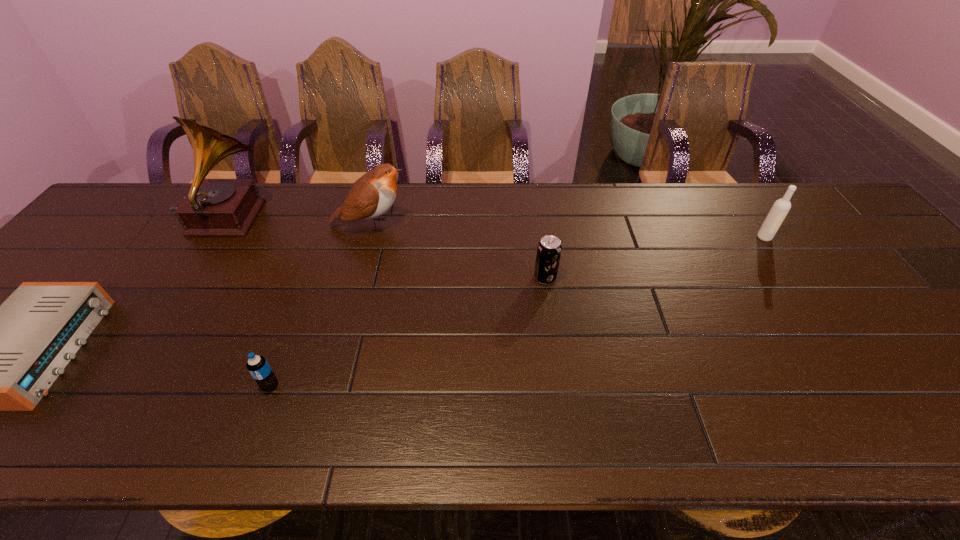
At what (x,y) coordinates should I click in order to perform the action: click on free space located 0.400m on the front of the right soda bottle. Please return your answer as a coordinate pair (x, y). Looking at the image, I should click on (568, 441).

This screenshot has width=960, height=540. In order to click on free space located 0.150m on the back of the left soda bottle in this screenshot , I will do `click(294, 322)`.

Identify the location of phonograph record that is at the far edge. This screenshot has width=960, height=540. (213, 207).

The image size is (960, 540). What are the coordinates of `bird at the far edge` in the screenshot? It's located at (372, 195).

Where is `free space at the far edge of the desktop`? The height and width of the screenshot is (540, 960). free space at the far edge of the desktop is located at coordinates (531, 196).

Identify the location of vacant space at the near edge. (743, 407).

Identify the location of vacant space at the right edge of the desktop. (953, 373).

Where is `vacant region at the far left corner`? This screenshot has height=540, width=960. vacant region at the far left corner is located at coordinates (150, 197).

Where is `vacant area that lies between the bird and the tallest object`? This screenshot has width=960, height=540. vacant area that lies between the bird and the tallest object is located at coordinates (298, 222).

At what (x,y) coordinates should I click in order to perform the action: click on free space that is in between the bird and the nearer soda bottle. Please return your answer as a coordinate pair (x, y). The height and width of the screenshot is (540, 960). Looking at the image, I should click on pyautogui.click(x=321, y=305).